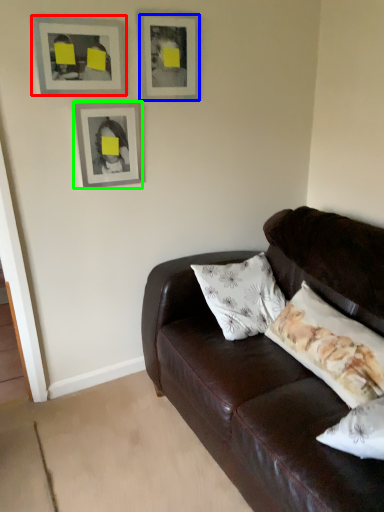
Question: Which object is positioned closest to picture frame (highlighted by a red box)? Select from picture frame (highlighted by a blue box) and picture frame (highlighted by a green box).

Choices:
 (A) picture frame
 (B) picture frame

Answer: (B)